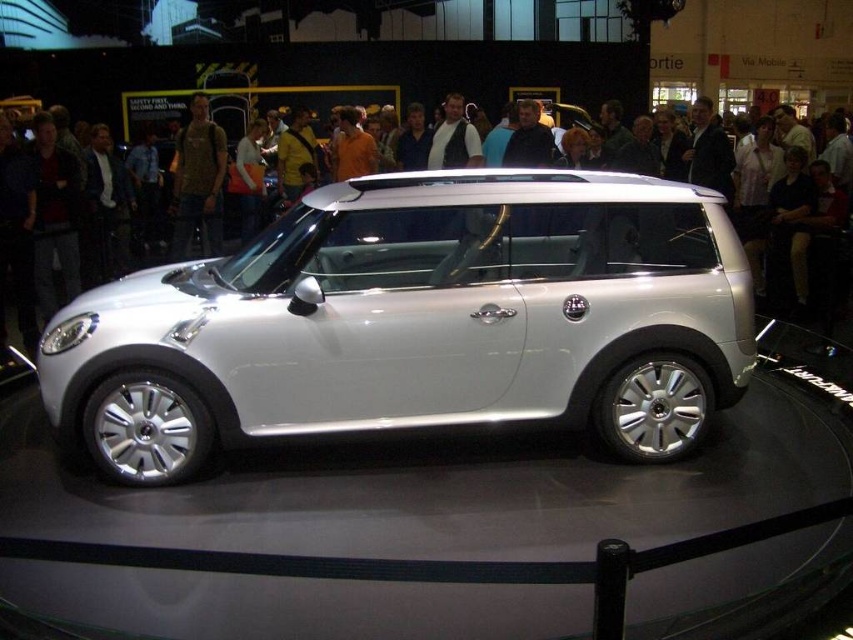
You are a photographer at the auto show and need to capture a photo of both the white metallic car at center and the matte white car at center. Since you want to include both cars in the frame, which car should you position closer to the camera to ensure they appear the same size?

The white metallic car at center is taller than the matte white car at center. To make them appear the same size in the photo, position the shorter matte white car at center closer to the camera than the taller white metallic car at center.

You are at an auto show and want to park your car next to the white metallic car at center. The parking spot has a width limit of 1.8 meters. Can you park there if you have the matte white car at center instead?

The white metallic car at center might be wider than matte white car at center. Since the parking spot has a width limit of 1.8 meters, the matte white car at center may fit if it is narrower than the metallic one. However, without exact measurements, it is uncertain whether it meets the limit.

You are standing at the center of the exhibition hall and see two points on the Mini Cooper car displayed there. The first point is at coordinate point (637, 330) and the second is at point (819, 182). Which point is nearer to your current position?

Point (637, 330) is closer to the camera than point (819, 182), so the first point is nearer to your current position.